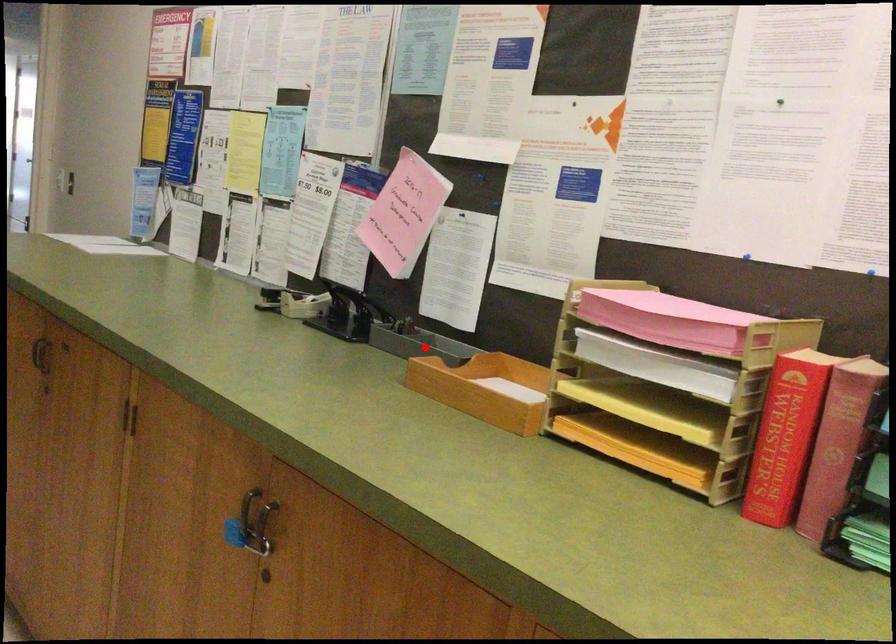
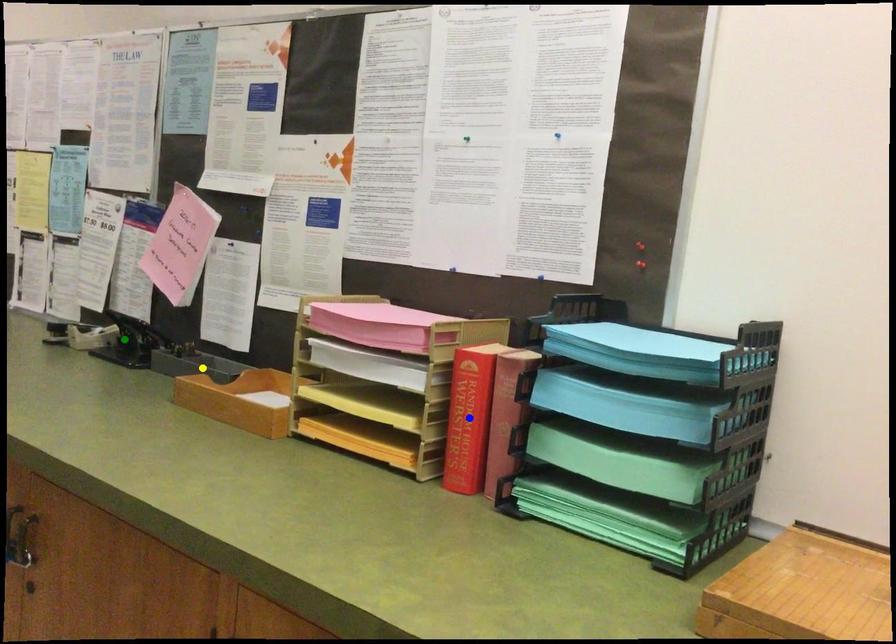
Question: I am providing you with two images of the same scene from different viewpoints. A red point is marked on the first image. You are given multiple points on the second image. Which point in image 2 represents the same 3d spot as the red point in image 1?

Choices:
 (A) blue point
 (B) green point
 (C) yellow point

Answer: (C)